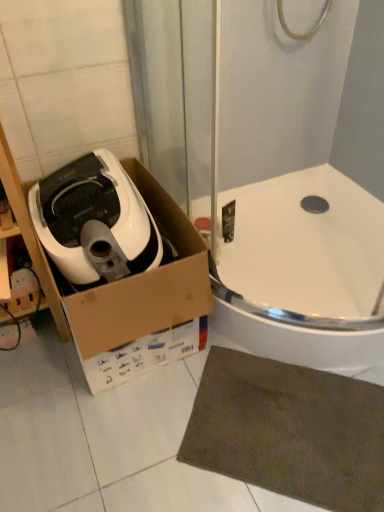
Where is `white cardboard box at left`? The image size is (384, 512). white cardboard box at left is located at coordinates pyautogui.click(x=121, y=266).

Where is `brown textured bath mat at lower right`? brown textured bath mat at lower right is located at coordinates (289, 431).

At what (x,y) coordinates should I click in order to perform the action: click on white cardboard box at left. Please return your answer as a coordinate pair (x, y). Looking at the image, I should click on (121, 266).

Is white cardboard box at left touching white glossy bath at center?

No, white cardboard box at left is not beside white glossy bath at center.

Which of these two, white cardboard box at left or white glossy bath at center, stands shorter?

white glossy bath at center.

Considering the positions of point (66, 214) and point (346, 231), is point (66, 214) closer or farther from the camera than point (346, 231)?

Point (66, 214) appears to be closer to the viewer than point (346, 231).

From the picture: What's the angular difference between white cardboard box at left and white glossy bath at center's facing directions?

There is a 1.03-degree angle between the facing directions of white cardboard box at left and white glossy bath at center.

From a real-world perspective, relative to brown textured bath mat at lower right, is white matte air fryer at left vertically above or below?

Clearly, from a real-world perspective, white matte air fryer at left is above brown textured bath mat at lower right.

Is white matte air fryer at left located outside brown textured bath mat at lower right?

Indeed, white matte air fryer at left is completely outside brown textured bath mat at lower right.

Is white matte air fryer at left facing away from brown textured bath mat at lower right?

That's not correct — white matte air fryer at left is not looking away from brown textured bath mat at lower right.

Is white matte air fryer at left at the right side of brown textured bath mat at lower right?

Incorrect, white matte air fryer at left is not on the right side of brown textured bath mat at lower right.

From the image's perspective, which is below, brown textured bath mat at lower right or white matte air fryer at left?

brown textured bath mat at lower right.

Based on the photo, is brown textured bath mat at lower right to the left of white matte air fryer at left from the viewer's perspective?

No.

Considering the sizes of objects brown textured bath mat at lower right and white matte air fryer at left in the image provided, who is thinner, brown textured bath mat at lower right or white matte air fryer at left?

With smaller width is brown textured bath mat at lower right.

The width and height of the screenshot is (384, 512). In the image, there is a white matte air fryer at left. What are the coordinates of `bath mat below it (from a real-world perspective)` in the screenshot? It's located at (289, 431).

From the image's perspective, which object appears higher, white glossy bath at center or white matte air fryer at left?

white matte air fryer at left.

Does white glossy bath at center appear on the right side of white matte air fryer at left?

Yes.

Considering the relative sizes of white glossy bath at center and white matte air fryer at left in the image provided, is white glossy bath at center bigger than white matte air fryer at left?

Yes, white glossy bath at center is bigger than white matte air fryer at left.

Does point (358, 367) appear closer or farther from the camera than point (274, 472)?

Point (358, 367) is positioned farther from the camera compared to point (274, 472).

Between white glossy bath at center and brown textured bath mat at lower right, which one has more height?

With more height is white glossy bath at center.

From a real-world perspective, is white glossy bath at center positioned under brown textured bath mat at lower right based on gravity?

Incorrect, from a real-world perspective, white glossy bath at center is higher than brown textured bath mat at lower right.

Considering the sizes of objects white glossy bath at center and brown textured bath mat at lower right in the image provided, who is wider, white glossy bath at center or brown textured bath mat at lower right?

white glossy bath at center is wider.

Who is more distant, white cardboard box at left or brown textured bath mat at lower right?

brown textured bath mat at lower right is more distant.

Identify the location of bath mat located on the right of white cardboard box at left. (289, 431).

Could you tell me if white cardboard box at left is turned towards brown textured bath mat at lower right?

Yes, white cardboard box at left is oriented towards brown textured bath mat at lower right.

Is point (145, 195) closer to camera compared to point (233, 376)?

That is False.

Would you say white matte air fryer at left is inside or outside white glossy bath at center?

white matte air fryer at left cannot be found inside white glossy bath at center.

Looking at this image, considering the relative sizes of white matte air fryer at left and white glossy bath at center in the image provided, is white matte air fryer at left bigger than white glossy bath at center?

No, white matte air fryer at left is not bigger than white glossy bath at center.

Consider the image. How different are the orientations of white matte air fryer at left and white glossy bath at center in degrees?

There is a 0.791-degree angle between the facing directions of white matte air fryer at left and white glossy bath at center.

Considering the positions of objects white matte air fryer at left and white glossy bath at center in the image provided, who is more to the left, white matte air fryer at left or white glossy bath at center?

Positioned to the left is white matte air fryer at left.

The width and height of the screenshot is (384, 512). Find the location of `cardboard box below the white glossy bath at center (from the image's perspective)`. cardboard box below the white glossy bath at center (from the image's perspective) is located at coordinates (121, 266).

Where is `bath mat behind the white matte air fryer at left`? This screenshot has width=384, height=512. bath mat behind the white matte air fryer at left is located at coordinates (289, 431).

Considering their positions, is white matte air fryer at left positioned further to white cardboard box at left than white glossy bath at center?

Among the two, white glossy bath at center is located further to white cardboard box at left.

From the image, which object appears to be farther from brown textured bath mat at lower right, white cardboard box at left or white glossy bath at center?

Among the two, white cardboard box at left is located further to brown textured bath mat at lower right.

Looking at the image, which one is located closer to white glossy bath at center, white cardboard box at left or brown textured bath mat at lower right?

Based on the image, brown textured bath mat at lower right appears to be nearer to white glossy bath at center.

Considering their positions, is white glossy bath at center positioned closer to brown textured bath mat at lower right than white matte air fryer at left?

white glossy bath at center lies closer to brown textured bath mat at lower right than the other object.

Which object lies nearer to the anchor point brown textured bath mat at lower right, white glossy bath at center or white cardboard box at left?

white glossy bath at center is closer to brown textured bath mat at lower right.

Consider the image. Looking at the image, which one is located further to brown textured bath mat at lower right, white matte air fryer at left or white cardboard box at left?

white matte air fryer at left lies further to brown textured bath mat at lower right than the other object.

Based on their spatial positions, is brown textured bath mat at lower right or white glossy bath at center further from white matte air fryer at left?

Among the two, brown textured bath mat at lower right is located further to white matte air fryer at left.

Which object lies further to the anchor point white cardboard box at left, white glossy bath at center or white matte air fryer at left?

Based on the image, white glossy bath at center appears to be further to white cardboard box at left.

Find the location of a particular element. The image size is (384, 512). cardboard box located between white matte air fryer at left and brown textured bath mat at lower right in the left-right direction is located at coordinates (121, 266).

At what (x,y) coordinates should I click in order to perform the action: click on cardboard box between white matte air fryer at left and white glossy bath at center in the horizontal direction. Please return your answer as a coordinate pair (x, y). This screenshot has width=384, height=512. Looking at the image, I should click on (121, 266).

At what (x,y) coordinates should I click in order to perform the action: click on bath mat between white cardboard box at left and white glossy bath at center. Please return your answer as a coordinate pair (x, y). The width and height of the screenshot is (384, 512). Looking at the image, I should click on (289, 431).

This screenshot has height=512, width=384. What are the coordinates of `bath mat between white matte air fryer at left and white glossy bath at center from left to right` in the screenshot? It's located at (289, 431).